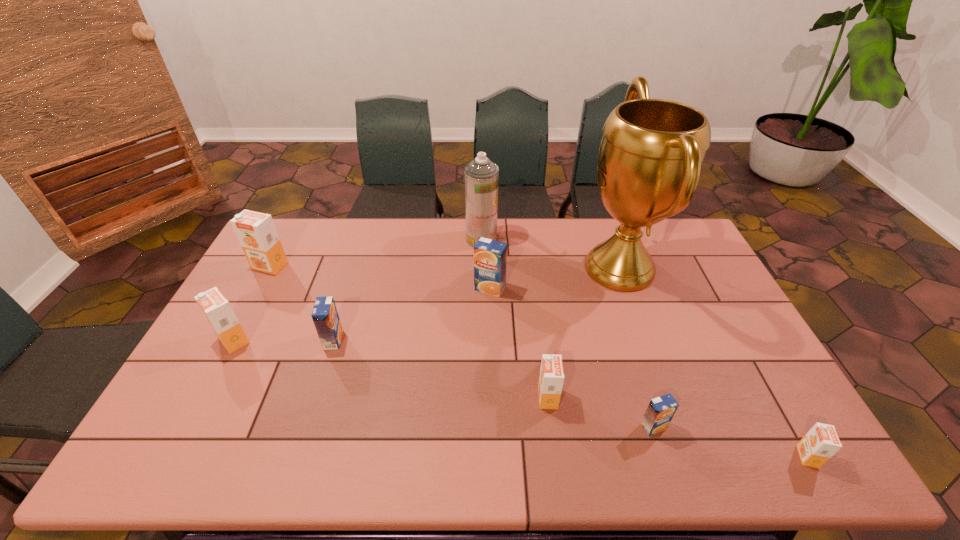
I want to click on object located in the near right corner section of the desktop, so click(x=821, y=442).

I want to click on vacant space at the far edge, so click(584, 219).

I want to click on blank space at the near edge of the desktop, so click(x=325, y=440).

Locate an element on the screen. The width and height of the screenshot is (960, 540). vacant space at the left edge of the desktop is located at coordinates (277, 310).

Where is `vacant space at the right edge`? vacant space at the right edge is located at coordinates (770, 414).

What are the coordinates of `free space at the far left corner` in the screenshot? It's located at (278, 235).

Locate an element on the screen. Image resolution: width=960 pixels, height=540 pixels. free spot at the far right corner of the desktop is located at coordinates (679, 247).

This screenshot has height=540, width=960. Identify the location of vacant region between the nearest object and the tallest object. (713, 362).

You are a GUI agent. You are given a task and a screenshot of the screen. Output one action in this format:
    pyautogui.click(x=<x>, y=<y>)
    Task: Click on the vacant area between the leftmost blue orange_juice and the eighth shortest object
    The height and width of the screenshot is (540, 960).
    Given the screenshot: What is the action you would take?
    pyautogui.click(x=407, y=289)

Where is `vacant space that's between the gold trophy cup and the farthest orange juice`? vacant space that's between the gold trophy cup and the farthest orange juice is located at coordinates (444, 267).